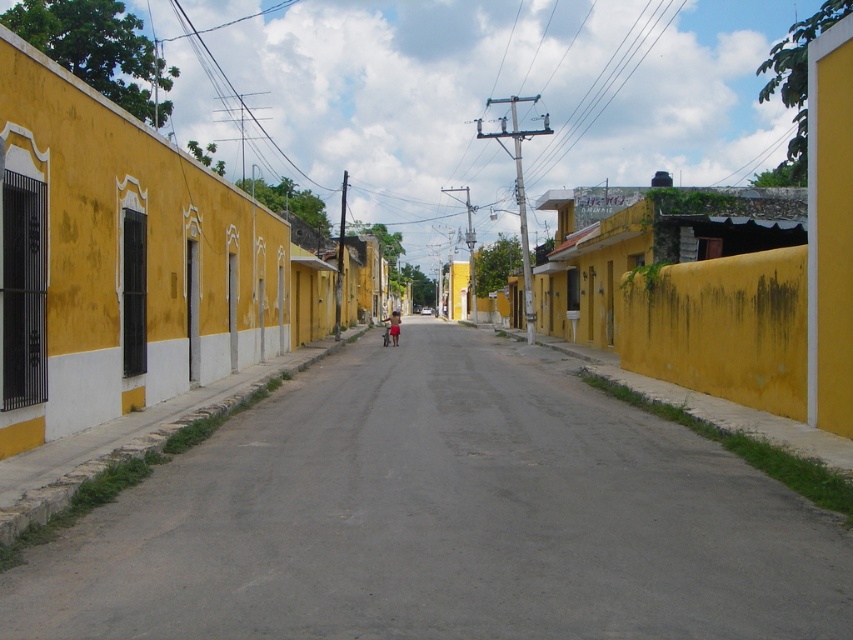
Question: Can you confirm if smooth asphalt road at center is wider than light brown skin at center?

Choices:
 (A) no
 (B) yes

Answer: (B)

Question: Does smooth asphalt road at center appear on the right side of light brown skin at center?

Choices:
 (A) no
 (B) yes

Answer: (B)

Question: Which object is closer to the camera taking this photo?

Choices:
 (A) light brown skin at center
 (B) smooth asphalt road at center

Answer: (B)

Question: Among these points, which one is nearest to the camera?

Choices:
 (A) (728, 560)
 (B) (392, 332)

Answer: (A)

Question: Can you confirm if smooth asphalt road at center is positioned above light brown skin at center?

Choices:
 (A) yes
 (B) no

Answer: (B)

Question: Among these objects, which one is farthest from the camera?

Choices:
 (A) smooth asphalt road at center
 (B) light brown skin at center

Answer: (B)